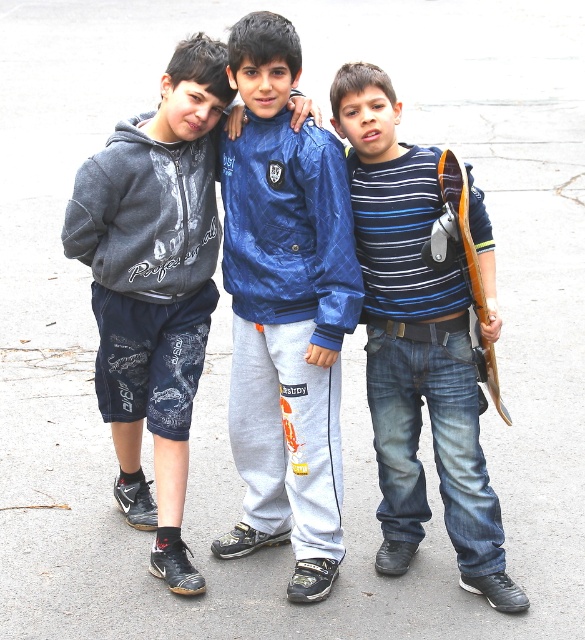
You are a photographer taking a picture of the two boys wearing the dark gray hoodie at center and the blue striped shirt at center. Which clothing item is covering the other?

The dark gray hoodie at center is positioned over the blue striped shirt at center, so it is covering the blue striped shirt at center.

In the scene shown: You are a photographer trying to capture a group photo of the three boys. The camera is set up at point A, which is located at coordinates 0.0,0.0. The photographer wants to ensure that all three boys are in the frame. Given that the camera has a field of view covering up to 1.0 units in both the x and y directions, can you confirm if the dark gray hoodie at center is within the camera frame?

The dark gray hoodie at center is located at point (154, 284), which is within the camera frame since the camera covers up to 1.0 units in both x and y directions.